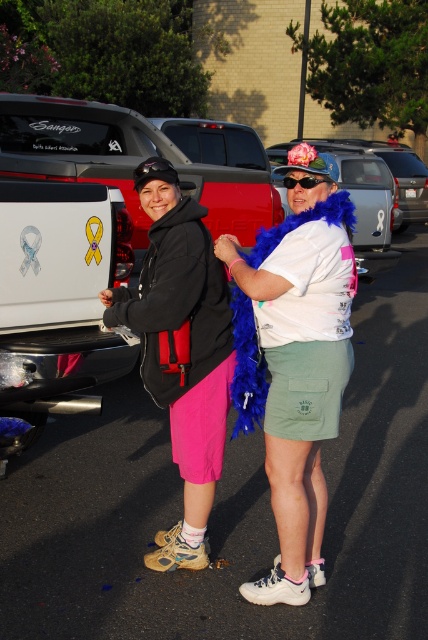
From the picture: Based on the scene description, where exactly is the white glossy pickup truck at left located in terms of coordinates?

The white glossy pickup truck at left is located at coordinates point (133, 166).

Based on the scene description, can you determine which object, the pink fabric shorts at center or the metallic silver car at center, is positioned higher in the image?

The pink fabric shorts at center is much taller than the metallic silver car at center, so the pink fabric shorts at center is positioned higher in the image.

In the scene shown: You are a photographer trying to capture a photo of the metallic silver car at center without any obstructions. The pink fabric shorts at center is in the way. Can you suggest a direction to move so that the car is still in frame but the shorts are no longer blocking the view?

Move to the left or right side of the metallic silver car at center so that the pink fabric shorts at center, which is positioned under the car, is no longer in the line of sight.